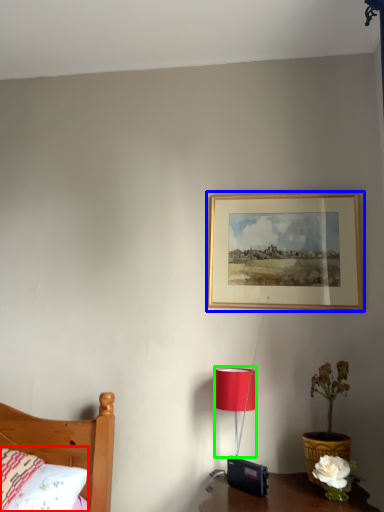
Question: Considering the real-world distances, which object is closest to pillow (highlighted by a red box)? picture frame (highlighted by a blue box) or lamp (highlighted by a green box).

Choices:
 (A) picture frame
 (B) lamp

Answer: (B)